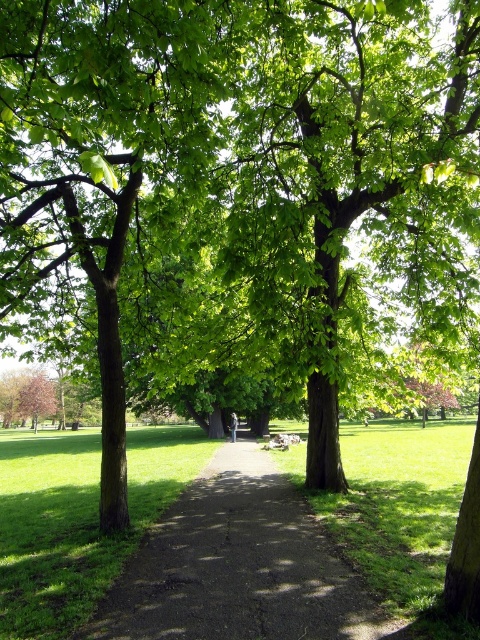
Based on the photo, you are standing at the starting point of the dirt path at center. If you walk straight ahead, which direction will you be facing relative to the park?

Since the dirt path at center is positioned at coordinates point [239,566], walking straight ahead along it would lead you towards the direction where the path continues into the distance, maintaining the same general direction as the path itself.